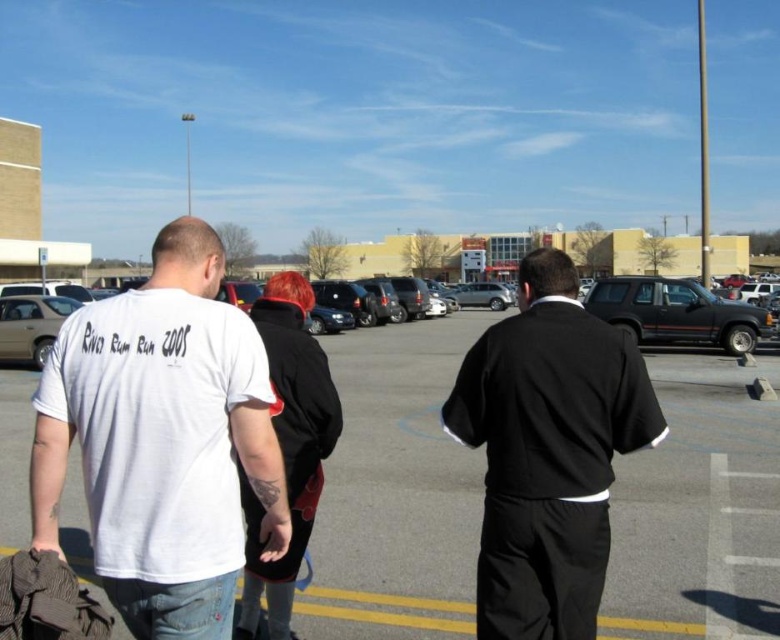
Question: Is black smooth suit at center thinner than matte silver sedan at left?

Choices:
 (A) yes
 (B) no

Answer: (A)

Question: Which of the following is the closest to the observer?

Choices:
 (A) (286, 342)
 (B) (234, 324)

Answer: (B)

Question: Considering the relative positions of black smooth suit at center and black leather jacket at center in the image provided, where is black smooth suit at center located with respect to black leather jacket at center?

Choices:
 (A) right
 (B) left

Answer: (A)

Question: Which point is closer to the camera?

Choices:
 (A) (734, 396)
 (B) (73, 404)
 (C) (314, 490)
 (D) (534, 349)

Answer: (B)

Question: Can you confirm if black leather jacket at center is positioned to the right of black matte suv at right?

Choices:
 (A) no
 (B) yes

Answer: (A)

Question: Among these objects, which one is nearest to the camera?

Choices:
 (A) white matte t-shirt at center
 (B) black matte suv at right
 (C) black leather jacket at center
 (D) white cotton t-shirt at center

Answer: (D)